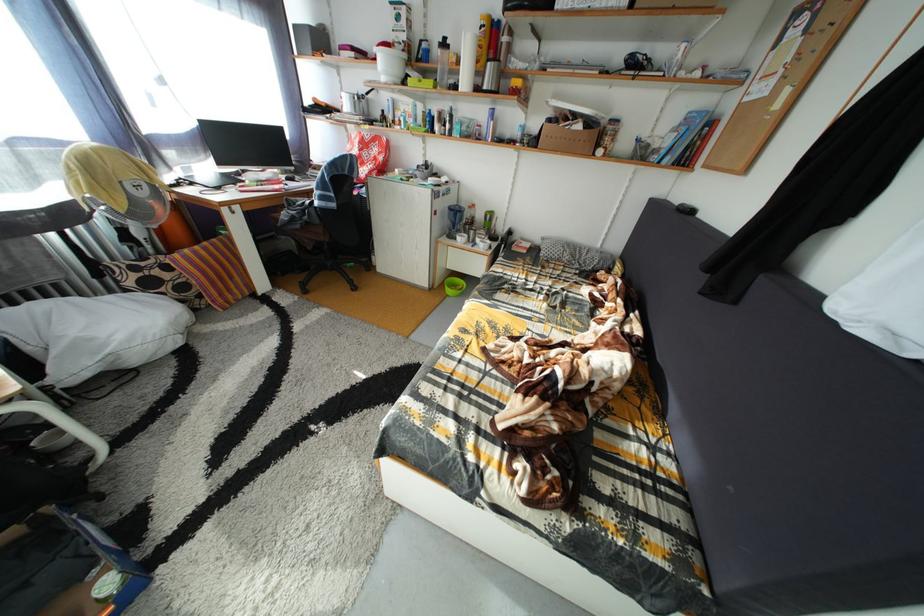
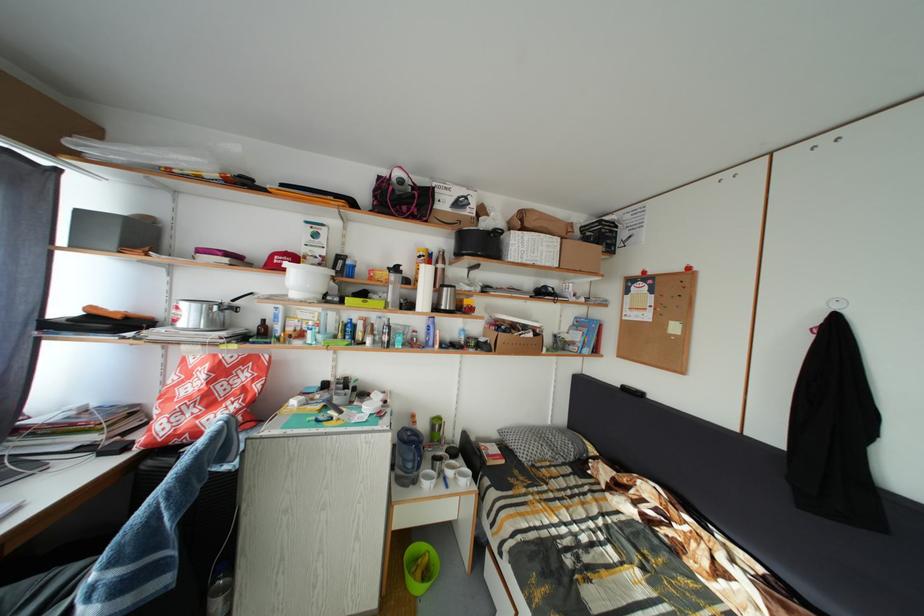
Where in the second image is the point corresponding to point (465, 245) from the first image?

(423, 488)